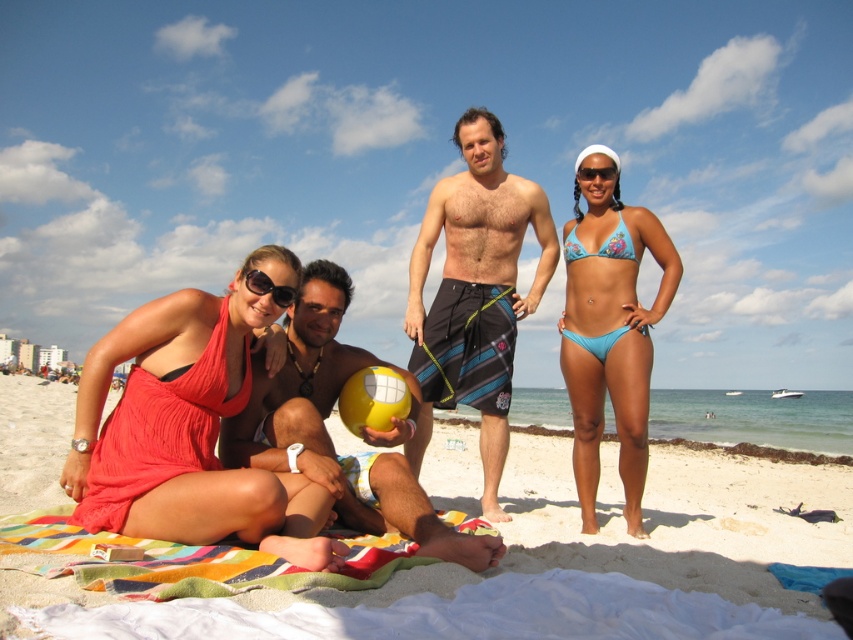
Question: Which point appears closest to the camera in this image?

Choices:
 (A) (318, 438)
 (B) (605, 166)
 (C) (383, 417)

Answer: (A)

Question: Can you confirm if blue floral bikini at upper right is bigger than black plastic sunglasses at center?

Choices:
 (A) no
 (B) yes

Answer: (B)

Question: Which point is closer to the camera taking this photo?

Choices:
 (A) (625, 244)
 (B) (277, 300)
 (C) (370, 401)
 (D) (338, 353)

Answer: (B)

Question: Based on their relative distances, which object is farther from the matte coral bikini at left?

Choices:
 (A) blue floral bikini at upper right
 (B) blue floral bikini at right
 (C) black plastic sunglasses at center
 (D) yellow rubber ball at center

Answer: (A)

Question: Is beach towel at lower center below blue striped boardshorts at center?

Choices:
 (A) no
 (B) yes

Answer: (B)

Question: Does beach towel at lower center appear over matte coral bikini at left?

Choices:
 (A) yes
 (B) no

Answer: (B)